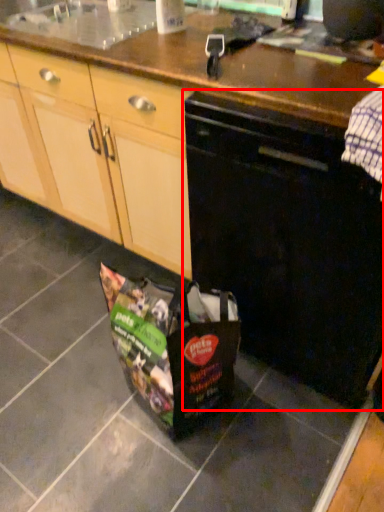
Question: From the image's perspective, what is the correct spatial relationship of home appliance (annotated by the red box) in relation to kitchen appliance?

Choices:
 (A) above
 (B) below

Answer: (B)